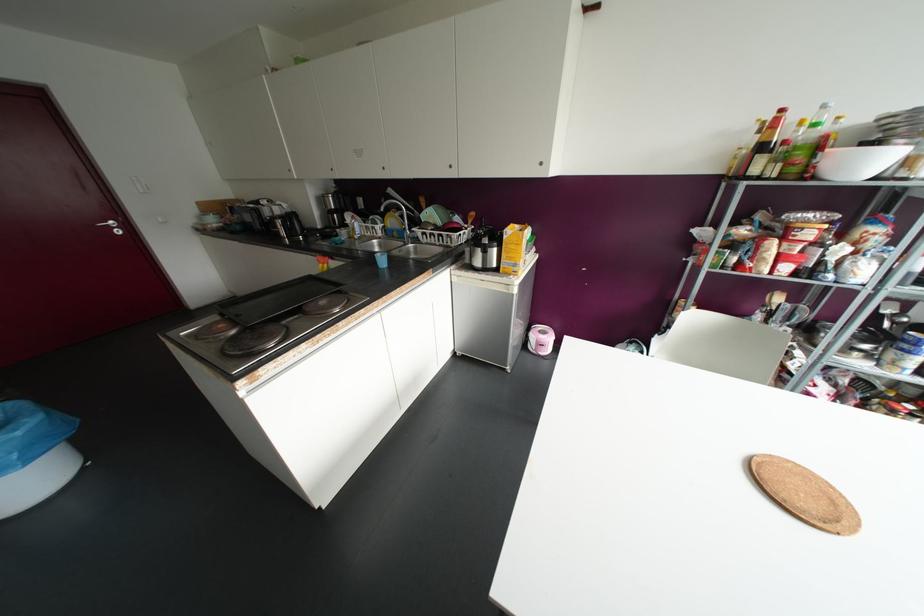
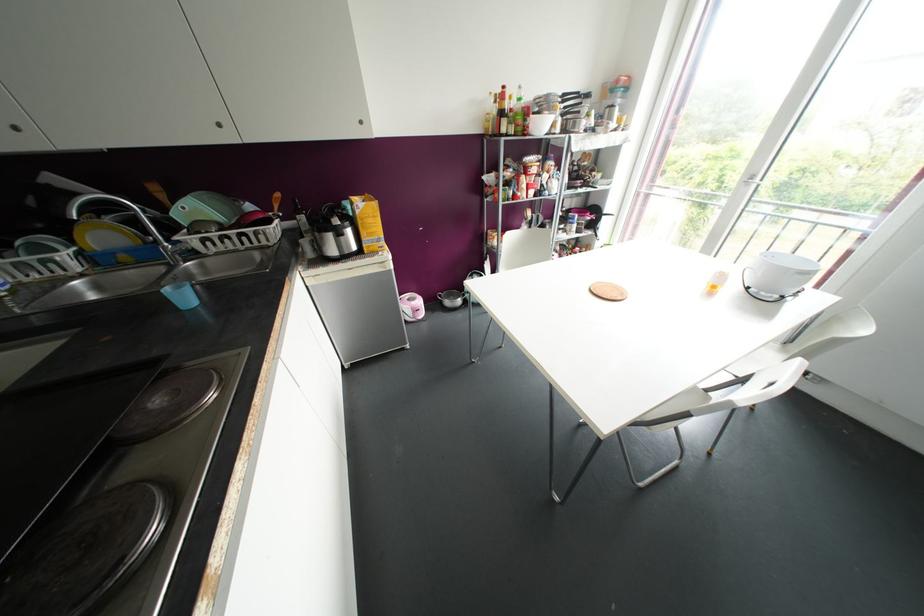
Where in the second image is the point corresponding to [513,246] from the first image?

(370, 220)